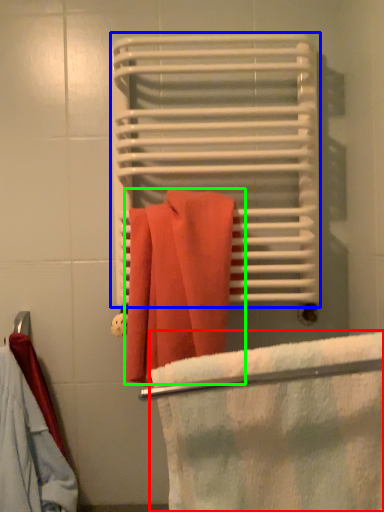
Question: Based on their relative distances, which object is farther from beach towel (highlighted by a red box)? Choose from bath towel (highlighted by a blue box) and towel (highlighted by a green box).

Choices:
 (A) bath towel
 (B) towel

Answer: (A)